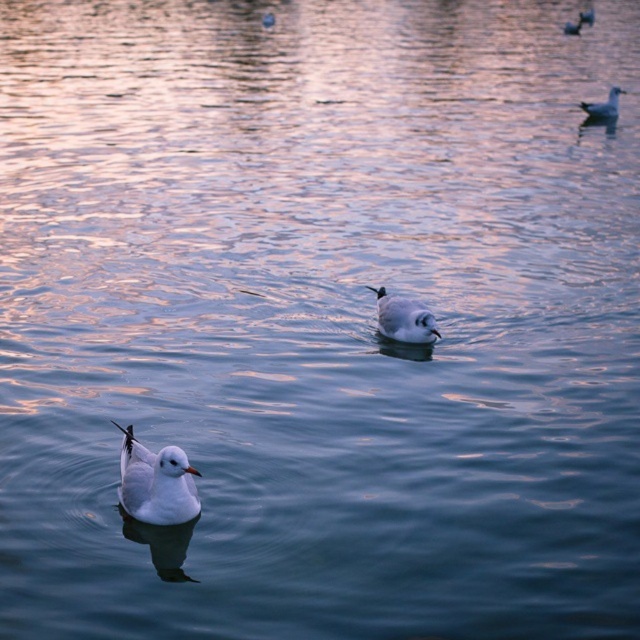
Can you confirm if white matte duck at lower left is thinner than white matte bird at upper right?

Yes, white matte duck at lower left is thinner than white matte bird at upper right.

How far apart are white matte duck at lower left and white matte bird at upper right?

white matte duck at lower left is 16.65 meters away from white matte bird at upper right.

Is point (173, 483) positioned before point (612, 88)?

Yes, it is in front of point (612, 88).

You are a GUI agent. You are given a task and a screenshot of the screen. Output one action in this format:
    pyautogui.click(x=<x>, y=<y>)
    Task: Click on the white matte duck at lower left
    The image size is (640, 640).
    Given the screenshot: What is the action you would take?
    156,483

Which is above, white matte duck at lower left or white matte bird at center?

white matte bird at center is higher up.

Is white matte duck at lower left bigger than white matte bird at center?

Indeed, white matte duck at lower left has a larger size compared to white matte bird at center.

Describe the element at coordinates (156, 483) in the screenshot. Image resolution: width=640 pixels, height=640 pixels. I see `white matte duck at lower left` at that location.

This screenshot has height=640, width=640. What are the coordinates of `white matte duck at lower left` in the screenshot? It's located at (156, 483).

Is point (404, 312) farther from camera compared to point (611, 99)?

No, (404, 312) is in front of (611, 99).

Is point (387, 314) positioned in front of point (586, 109)?

Yes.

The image size is (640, 640). What are the coordinates of `white matte bird at center` in the screenshot? It's located at (403, 317).

I want to click on white matte bird at center, so click(x=403, y=317).